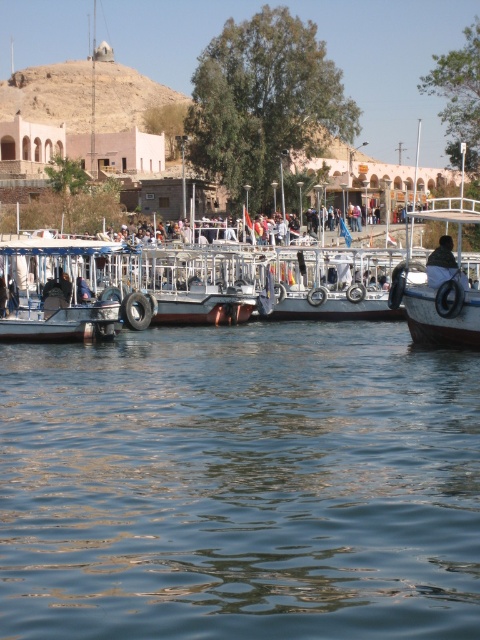
Question: Is transparent water at center to the left of white matte boat at right from the viewer's perspective?

Choices:
 (A) yes
 (B) no

Answer: (A)

Question: Which object is farther from the camera taking this photo?

Choices:
 (A) dark brown leather jacket at center
 (B) transparent water at center
 (C) white matte boat at right

Answer: (A)

Question: Can you confirm if white wooden boat at left is positioned to the left of dark brown leather jacket at center?

Choices:
 (A) no
 (B) yes

Answer: (B)

Question: Considering the real-world distances, which object is closest to the transparent water at center?

Choices:
 (A) white wooden boat at left
 (B) dark brown leather jacket at center
 (C) white matte boat at right

Answer: (A)

Question: Does white wooden boat at left come in front of white matte boat at right?

Choices:
 (A) yes
 (B) no

Answer: (B)

Question: Which is farther from the white matte boat at right?

Choices:
 (A) dark brown leather jacket at center
 (B) white wooden boat at left
 (C) transparent water at center

Answer: (B)